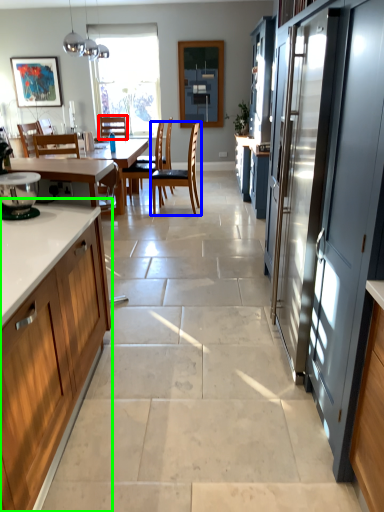
Question: Considering the real-world distances, which object is closest to chair (highlighted by a red box)? chair (highlighted by a blue box) or cabinetry (highlighted by a green box).

Choices:
 (A) chair
 (B) cabinetry

Answer: (A)